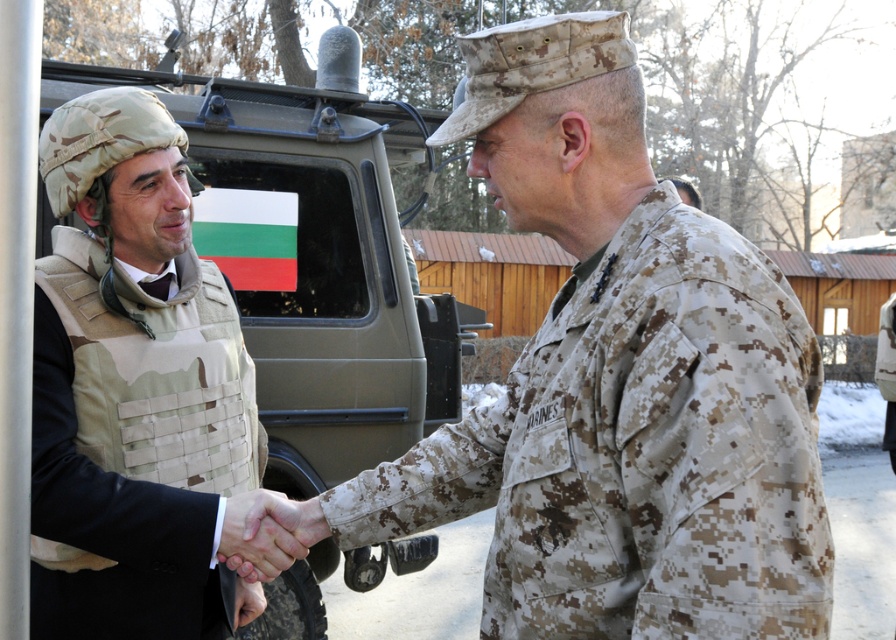
You are a photographer taking a picture of the two individuals shaking hands. You want to focus on the camouflage fabric uniform at center and the camouflage fabric vest at center. Which one should you adjust your camera focus to first if you want to capture both clearly?

The camouflage fabric uniform at center is closer to the viewer than the camouflage fabric vest at center, so you should focus on the camouflage fabric uniform at center first to ensure both are in focus.

You are a photographer at the scene capturing the interaction between the two individuals. You notice the camouflage fabric vest at center and the smooth skin handshake at center. Which object is closer to the camera lens?

The camouflage fabric vest at center is positioned over the smooth skin handshake at center, so the camouflage fabric vest at center is closer to the camera lens.

You are a photographer taking a picture of the two individuals shaking hands. You need to ensure that both the camouflage fabric vest at center and the smooth skin handshake at center are clearly visible in the frame. Given their sizes, which object should you focus on to make sure both are in focus?

The camouflage fabric vest at center is bigger than the smooth skin handshake at center, so focusing on the larger camouflage fabric vest at center will ensure both objects are in focus.